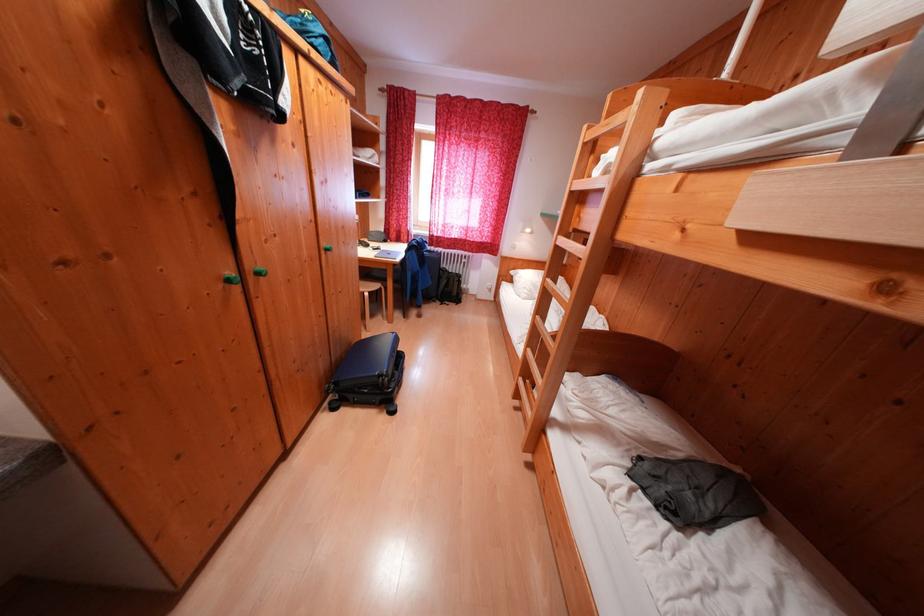
I want to click on white pillow, so click(x=526, y=282).